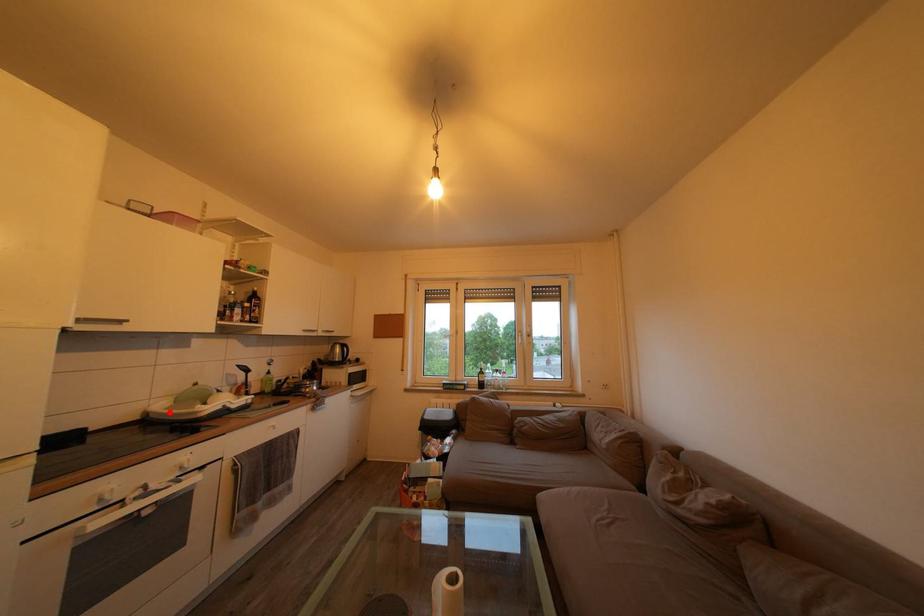
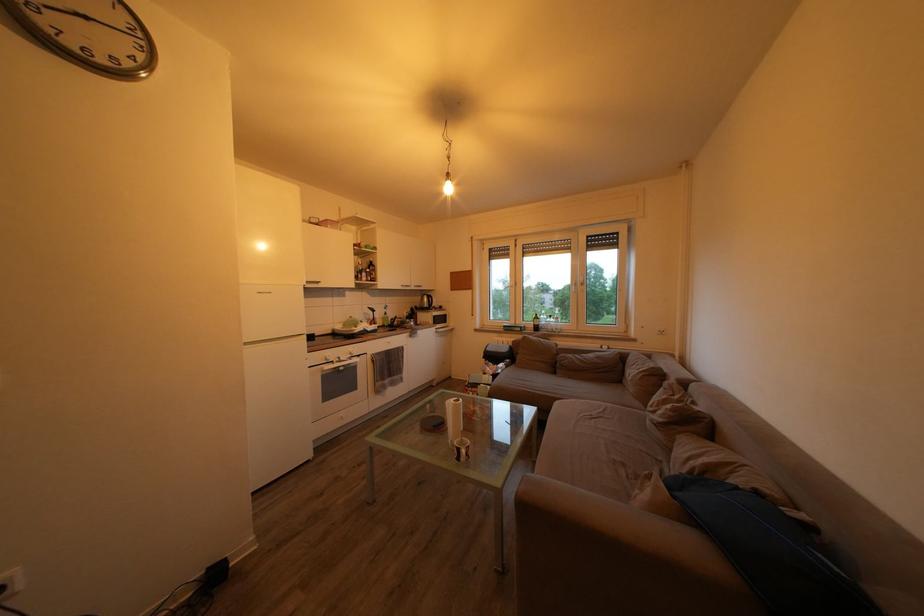
In the second image, find the point that corresponds to the highlighted location in the first image.

(346, 333)